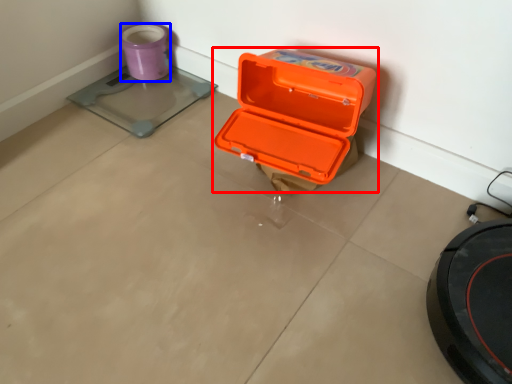
Question: Which object is closer to the camera taking this photo, box (highlighted by a red box) or appliance (highlighted by a blue box)?

Choices:
 (A) box
 (B) appliance

Answer: (A)